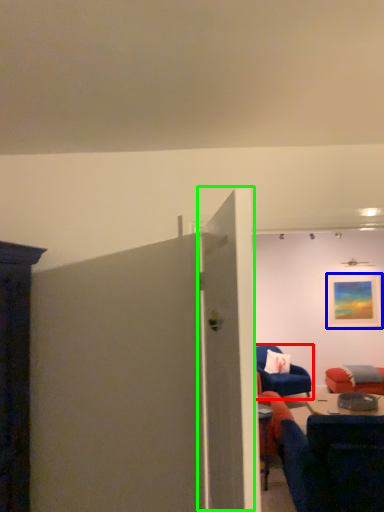
Question: Based on their relative distances, which object is farther from chair (highlighted by a red box)? Choose from picture frame (highlighted by a blue box) and door (highlighted by a green box).

Choices:
 (A) picture frame
 (B) door

Answer: (B)